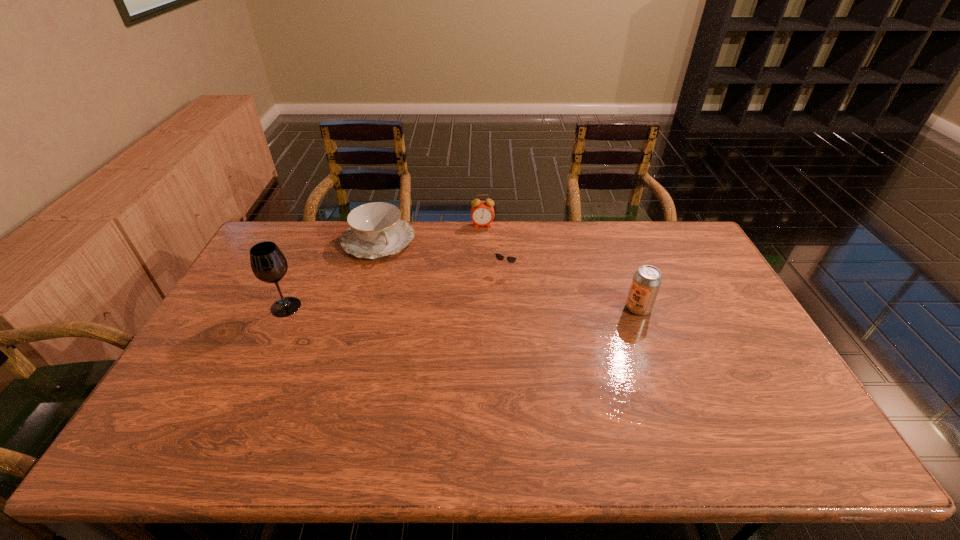
This screenshot has height=540, width=960. I want to click on vacant space located 0.300m in front of the lenses of the sunglasses, so click(464, 345).

What are the coordinates of `blank space located in front of the lenses of the sunglasses` in the screenshot? It's located at (452, 369).

This screenshot has height=540, width=960. Find the location of `vacant region located 0.330m on the face of the alarm clock`. vacant region located 0.330m on the face of the alarm clock is located at coordinates (490, 287).

The height and width of the screenshot is (540, 960). I want to click on free spot located on the face of the alarm clock, so click(x=487, y=260).

Find the location of a particular element. free spot located on the face of the alarm clock is located at coordinates point(490,293).

You are a GUI agent. You are given a task and a screenshot of the screen. Output one action in this format:
    pyautogui.click(x=<x>, y=<y>)
    Task: Click on the vacant area situated 0.170m on the handle side of the second shortest object
    The height and width of the screenshot is (540, 960).
    Given the screenshot: What is the action you would take?
    pyautogui.click(x=410, y=289)

Identify the location of vacant space located 0.340m on the handle side of the second shortest object. The width and height of the screenshot is (960, 540). (432, 323).

The image size is (960, 540). What are the coordinates of `vacant point located on the handle side of the second shortest object` in the screenshot? It's located at (419, 302).

Find the location of a particular element. The height and width of the screenshot is (540, 960). sunglasses located in the far edge section of the desktop is located at coordinates (511, 259).

Identify the location of alarm clock situated at the far edge. (482, 212).